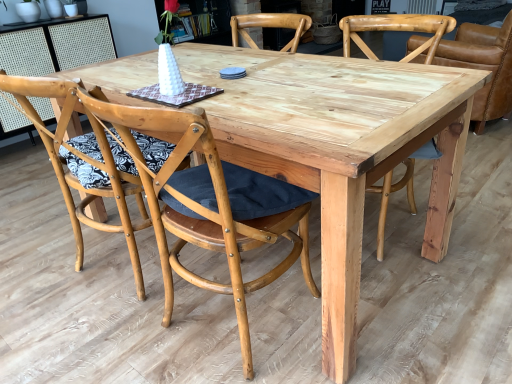
Question: Can you confirm if natural wood chair at right, which is counted as the fourth chair, starting from the left, is shorter than natural wood chair at center, which is the 4th chair in right-to-left order?

Choices:
 (A) yes
 (B) no

Answer: (A)

Question: Is natural wood chair at right, the first chair viewed from the right, next to natural wood chair at center, which is the 4th chair in right-to-left order?

Choices:
 (A) yes
 (B) no

Answer: (B)

Question: Does natural wood chair at right, which is counted as the fourth chair, starting from the left, have a lesser width compared to natural wood chair at center, which ranks as the first chair in left-to-right order?

Choices:
 (A) no
 (B) yes

Answer: (A)

Question: From the image's perspective, is natural wood chair at right, the first chair viewed from the right, located above natural wood chair at center, which is the 4th chair in right-to-left order?

Choices:
 (A) yes
 (B) no

Answer: (A)

Question: Does natural wood chair at right, the first chair viewed from the right, have a greater height compared to natural wood chair at center, which ranks as the first chair in left-to-right order?

Choices:
 (A) no
 (B) yes

Answer: (A)

Question: Considering the relative positions of natural wood chair at center, which ranks as the first chair in left-to-right order, and natural wood chair at center, the 2th chair from the left, in the image provided, is natural wood chair at center, which ranks as the first chair in left-to-right order, to the left or to the right of natural wood chair at center, the 2th chair from the left,?

Choices:
 (A) right
 (B) left

Answer: (B)

Question: From the image's perspective, is natural wood chair at center, which ranks as the first chair in left-to-right order, positioned above or below natural wood chair at center, acting as the third chair starting from the right?

Choices:
 (A) below
 (B) above

Answer: (B)

Question: Does point (109, 228) appear closer or farther from the camera than point (144, 119)?

Choices:
 (A) closer
 (B) farther

Answer: (B)

Question: Is natural wood chair at center, which is the 4th chair in right-to-left order, in front of or behind natural wood chair at center, acting as the third chair starting from the right, in the image?

Choices:
 (A) front
 (B) behind

Answer: (B)

Question: In terms of height, does natural wood chair at center, the 2th chair from the left, look taller or shorter compared to natural wood chair at center, which ranks as the second chair in right-to-left order?

Choices:
 (A) short
 (B) tall

Answer: (B)

Question: Is natural wood chair at center, acting as the third chair starting from the right, in front of or behind natural wood chair at center, marked as the third chair in a left-to-right arrangement, in the image?

Choices:
 (A) front
 (B) behind

Answer: (A)

Question: Would you say natural wood chair at center, acting as the third chair starting from the right, is to the left or to the right of natural wood chair at center, which ranks as the second chair in right-to-left order, in the picture?

Choices:
 (A) right
 (B) left

Answer: (B)

Question: Is natural wood chair at center, acting as the third chair starting from the right, bigger or smaller than natural wood chair at center, which ranks as the second chair in right-to-left order?

Choices:
 (A) small
 (B) big

Answer: (A)

Question: Does point (380, 14) appear closer or farther from the camera than point (263, 195)?

Choices:
 (A) farther
 (B) closer

Answer: (A)

Question: Which is correct: natural wood chair at center, which ranks as the second chair in right-to-left order, is inside natural wood chair at center, the 2th chair from the left, or outside of it?

Choices:
 (A) outside
 (B) inside

Answer: (A)